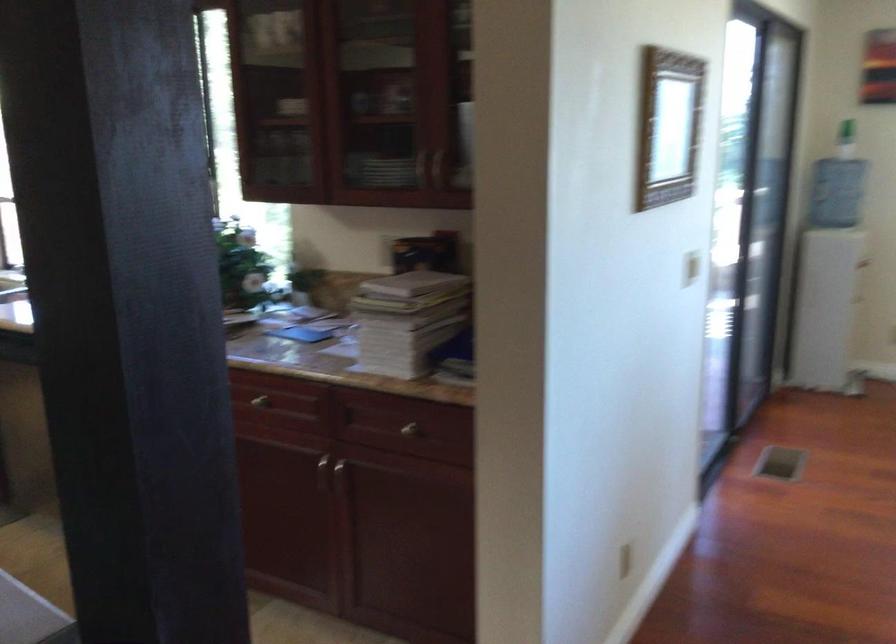
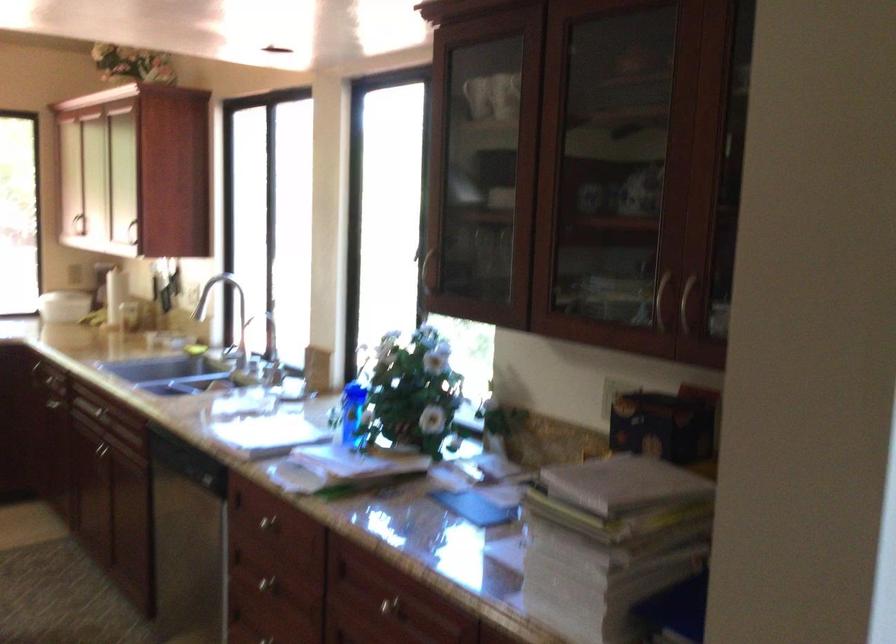
Question: Which direction would the cameraman need to move to produce the second image? Reply with the corresponding letter.

Choices:
 (A) Left
 (B) Right
 (C) Forward
 (D) Backward

Answer: (C)